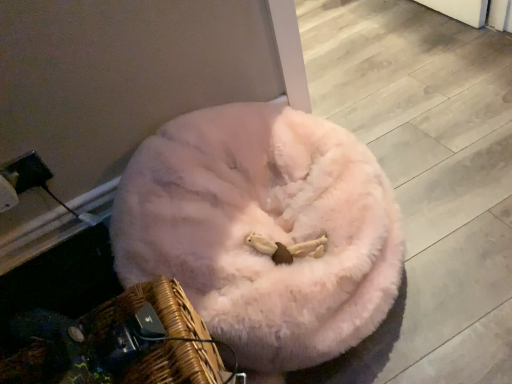
Find the location of `free spot to the right of fluffy pink dog bed at center`. free spot to the right of fluffy pink dog bed at center is located at coordinates (446, 167).